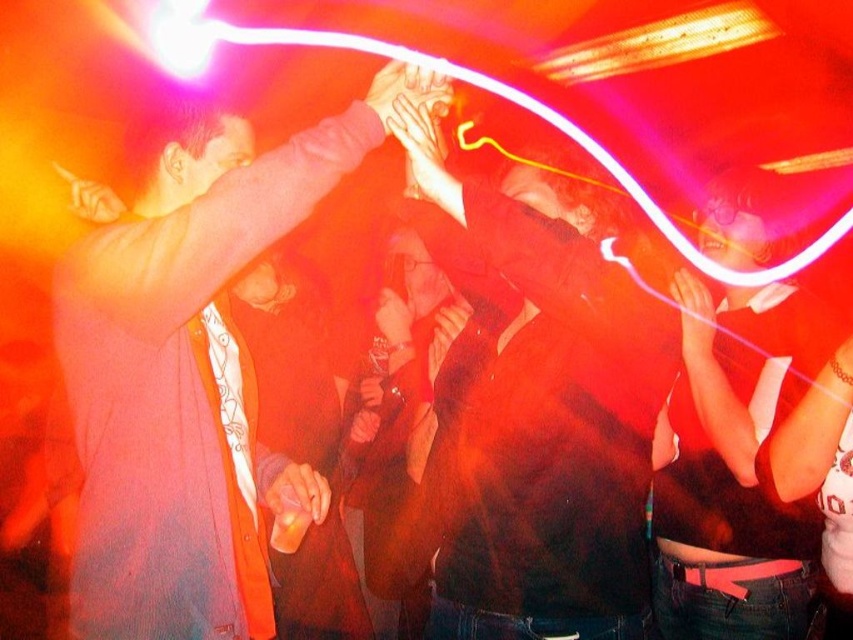
Question: Which of the following is the closest to the observer?

Choices:
 (A) (415, 560)
 (B) (99, 522)

Answer: (B)

Question: Is matte pink sweater at upper left bigger than dark brown leather jacket at center?

Choices:
 (A) yes
 (B) no

Answer: (B)

Question: Does matte pink sweater at upper left have a greater width compared to dark brown leather jacket at center?

Choices:
 (A) no
 (B) yes

Answer: (A)

Question: Can you confirm if matte pink sweater at upper left is positioned below dark brown leather jacket at center?

Choices:
 (A) no
 (B) yes

Answer: (A)